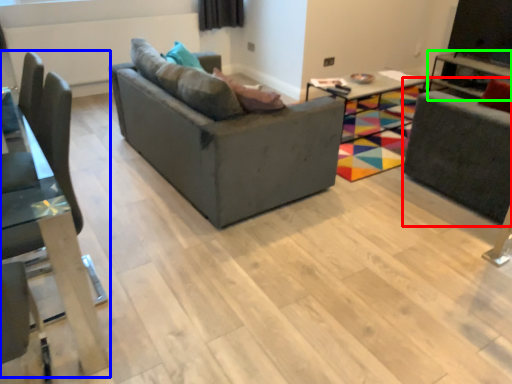
Question: Which object is the farthest from swivel chair (highlighted by a red box)? Choose among these: chair (highlighted by a blue box) or table (highlighted by a green box).

Choices:
 (A) chair
 (B) table

Answer: (A)